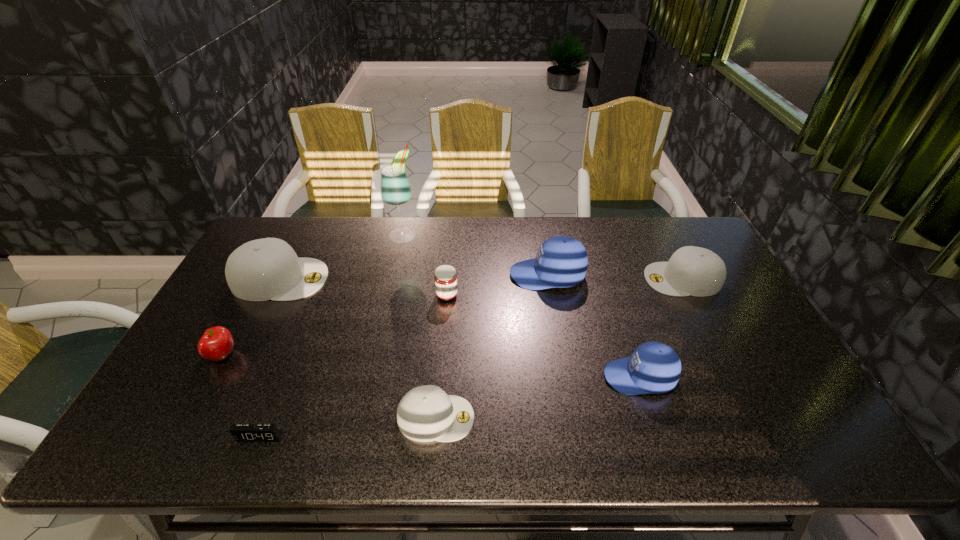
I want to click on cap that is the fourth closest to the leftmost gray cap, so click(x=696, y=271).

Locate an element on the screen. The height and width of the screenshot is (540, 960). the second closest cap relative to the fourth cap from right to left is located at coordinates (561, 261).

Image resolution: width=960 pixels, height=540 pixels. Identify the location of gray cap that is the third closest to the smaller blue cap. (264, 269).

Point out which gray cap is positioned as the third nearest to the nearer blue cap. Please provide its 2D coordinates. Your answer should be formatted as a tuple, i.e. [(x, y)], where the tuple contains the x and y coordinates of a point satisfying the conditions above.

[(264, 269)]

Find the location of a particular element. free point that satisfies the following two spatial constraints: 1. on the front-facing side of the nearer blue cap; 2. on the front-facing side of the alarm clock is located at coordinates (659, 437).